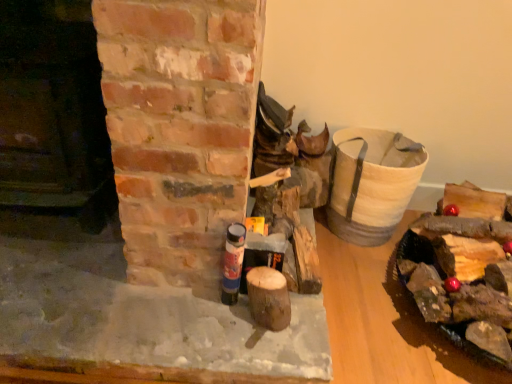
This screenshot has height=384, width=512. What do you see at coordinates (465, 267) in the screenshot?
I see `wooden logs at right` at bounding box center [465, 267].

You are a GUI agent. You are given a task and a screenshot of the screen. Output one action in this format:
    pyautogui.click(x=<x>, y=<y>)
    Task: Click on the blue matte spray can at center
    The image size is (512, 384).
    Given the screenshot: What is the action you would take?
    (232, 263)

How much space does smooth brick fireplace at center, the second fireplace in the top-to-bottom sequence, occupy horizontally?

3.66 feet.

Locate an element on the screen. The height and width of the screenshot is (384, 512). smooth dark brown wood at left, which ranks as the 1th fireplace in top-to-bottom order is located at coordinates (53, 125).

Do you think smooth dark brown wood at left, which ranks as the 1th fireplace in top-to-bottom order, is within wooden logs at right, or outside of it?

smooth dark brown wood at left, which ranks as the 1th fireplace in top-to-bottom order, is not enclosed by wooden logs at right.

Between smooth dark brown wood at left, which ranks as the 1th fireplace in top-to-bottom order, and wooden logs at right, which one has smaller size?

wooden logs at right.

Considering the relative positions of smooth dark brown wood at left, which ranks as the 1th fireplace in top-to-bottom order, and wooden logs at right in the image provided, is smooth dark brown wood at left, which ranks as the 1th fireplace in top-to-bottom order, to the left or to the right of wooden logs at right?

From the image, it's evident that smooth dark brown wood at left, which ranks as the 1th fireplace in top-to-bottom order, is to the left of wooden logs at right.

Does blue matte spray can at center come behind wooden logs at right?

Yes, the depth of blue matte spray can at center is greater than that of wooden logs at right.

Is point (223, 295) behind point (468, 332)?

Yes.

Does blue matte spray can at center appear on the right side of wooden logs at right?

No.

From a real-world perspective, is blue matte spray can at center physically located above or below wooden logs at right?

In terms of real-world spatial position, blue matte spray can at center is above wooden logs at right.

Which of these two, wooden logs at right or smooth dark brown wood at left, placed as the 2th fireplace when sorted from bottom to top, stands shorter?

wooden logs at right is shorter.

From the image's perspective, is wooden logs at right above or below smooth dark brown wood at left, placed as the 2th fireplace when sorted from bottom to top?

wooden logs at right is situated lower than smooth dark brown wood at left, placed as the 2th fireplace when sorted from bottom to top, in the image.

Considering the sizes of wooden logs at right and smooth dark brown wood at left, placed as the 2th fireplace when sorted from bottom to top, in the image, is wooden logs at right bigger or smaller than smooth dark brown wood at left, placed as the 2th fireplace when sorted from bottom to top,?

Considering their sizes, wooden logs at right takes up less space than smooth dark brown wood at left, placed as the 2th fireplace when sorted from bottom to top.

From a real-world perspective, which object stands above the other?

smooth dark brown wood at left, which ranks as the 1th fireplace in top-to-bottom order, from a real-world perspective.

Considering the positions of objects blue matte spray can at center and smooth dark brown wood at left, which ranks as the 1th fireplace in top-to-bottom order, in the image provided, who is in front, blue matte spray can at center or smooth dark brown wood at left, which ranks as the 1th fireplace in top-to-bottom order,?

smooth dark brown wood at left, which ranks as the 1th fireplace in top-to-bottom order, is more forward.

Is blue matte spray can at center not near smooth dark brown wood at left, placed as the 2th fireplace when sorted from bottom to top?

Actually, blue matte spray can at center and smooth dark brown wood at left, placed as the 2th fireplace when sorted from bottom to top, are a little close together.

Looking at this image, which object is wider, blue matte spray can at center or smooth dark brown wood at left, placed as the 2th fireplace when sorted from bottom to top?

With larger width is smooth dark brown wood at left, placed as the 2th fireplace when sorted from bottom to top.

Between blue matte spray can at center and smooth brick fireplace at center, which appears as the first fireplace when ordered from the bottom, which one has less height?

With less height is smooth brick fireplace at center, which appears as the first fireplace when ordered from the bottom.

Consider the image. From a real-world perspective, is blue matte spray can at center positioned above or below smooth brick fireplace at center, which appears as the first fireplace when ordered from the bottom?

blue matte spray can at center is situated higher than smooth brick fireplace at center, which appears as the first fireplace when ordered from the bottom, in the real world.

Based on the photo, can you confirm if blue matte spray can at center is thinner than smooth brick fireplace at center, which appears as the first fireplace when ordered from the bottom?

Correct, the width of blue matte spray can at center is less than that of smooth brick fireplace at center, which appears as the first fireplace when ordered from the bottom.

In the scene shown: Can you tell me how much blue matte spray can at center and smooth brick fireplace at center, the second fireplace in the top-to-bottom sequence, differ in facing direction?

1.97 degrees separate the facing orientations of blue matte spray can at center and smooth brick fireplace at center, the second fireplace in the top-to-bottom sequence.

Is smooth dark brown wood at left, placed as the 2th fireplace when sorted from bottom to top, outside of smooth brick fireplace at center, the second fireplace in the top-to-bottom sequence?

Absolutely, smooth dark brown wood at left, placed as the 2th fireplace when sorted from bottom to top, is external to smooth brick fireplace at center, the second fireplace in the top-to-bottom sequence.

Is smooth dark brown wood at left, which ranks as the 1th fireplace in top-to-bottom order, thinner than smooth brick fireplace at center, the second fireplace in the top-to-bottom sequence?

Yes, smooth dark brown wood at left, which ranks as the 1th fireplace in top-to-bottom order, is thinner than smooth brick fireplace at center, the second fireplace in the top-to-bottom sequence.

Considering the sizes of objects smooth dark brown wood at left, placed as the 2th fireplace when sorted from bottom to top, and smooth brick fireplace at center, the second fireplace in the top-to-bottom sequence, in the image provided, who is taller, smooth dark brown wood at left, placed as the 2th fireplace when sorted from bottom to top, or smooth brick fireplace at center, the second fireplace in the top-to-bottom sequence,?

smooth dark brown wood at left, placed as the 2th fireplace when sorted from bottom to top, is taller.

Is smooth dark brown wood at left, placed as the 2th fireplace when sorted from bottom to top, far from smooth brick fireplace at center, which appears as the first fireplace when ordered from the bottom?

No.

Consider the image. Is smooth brick fireplace at center, which appears as the first fireplace when ordered from the bottom, wider or thinner than blue matte spray can at center?

smooth brick fireplace at center, which appears as the first fireplace when ordered from the bottom, is wider than blue matte spray can at center.

Which object is further away from the camera, smooth brick fireplace at center, which appears as the first fireplace when ordered from the bottom, or blue matte spray can at center?

blue matte spray can at center is more distant.

Measure the distance from smooth brick fireplace at center, which appears as the first fireplace when ordered from the bottom, to blue matte spray can at center.

The distance of smooth brick fireplace at center, which appears as the first fireplace when ordered from the bottom, from blue matte spray can at center is 28.90 centimeters.

From the image's perspective, would you say smooth brick fireplace at center, which appears as the first fireplace when ordered from the bottom, is positioned over blue matte spray can at center?

Correct, smooth brick fireplace at center, which appears as the first fireplace when ordered from the bottom, appears higher than blue matte spray can at center in the image.

The height and width of the screenshot is (384, 512). What are the coordinates of `fireplace above the wooden logs at right (from a real-world perspective)` in the screenshot? It's located at (53, 125).

Image resolution: width=512 pixels, height=384 pixels. I want to click on debris below the blue matte spray can at center (from a real-world perspective), so click(465, 267).

Considering their positions, is blue matte spray can at center positioned closer to wooden logs at right than smooth dark brown wood at left, which ranks as the 1th fireplace in top-to-bottom order?

Based on the image, blue matte spray can at center appears to be nearer to wooden logs at right.

Which object lies nearer to the anchor point smooth dark brown wood at left, which ranks as the 1th fireplace in top-to-bottom order, smooth brick fireplace at center, the second fireplace in the top-to-bottom sequence, or blue matte spray can at center?

smooth brick fireplace at center, the second fireplace in the top-to-bottom sequence.

Estimate the real-world distances between objects in this image. Which object is further from smooth dark brown wood at left, which ranks as the 1th fireplace in top-to-bottom order, blue matte spray can at center or smooth brick fireplace at center, the second fireplace in the top-to-bottom sequence?

blue matte spray can at center is further to smooth dark brown wood at left, which ranks as the 1th fireplace in top-to-bottom order.

Looking at this image, which object lies nearer to the anchor point smooth brick fireplace at center, the second fireplace in the top-to-bottom sequence, smooth dark brown wood at left, placed as the 2th fireplace when sorted from bottom to top, or blue matte spray can at center?

Based on the image, blue matte spray can at center appears to be nearer to smooth brick fireplace at center, the second fireplace in the top-to-bottom sequence.

Estimate the real-world distances between objects in this image. Which object is closer to blue matte spray can at center, smooth dark brown wood at left, placed as the 2th fireplace when sorted from bottom to top, or smooth brick fireplace at center, which appears as the first fireplace when ordered from the bottom?

smooth brick fireplace at center, which appears as the first fireplace when ordered from the bottom, lies closer to blue matte spray can at center than the other object.

When comparing their distances from smooth brick fireplace at center, the second fireplace in the top-to-bottom sequence, does wooden logs at right or smooth dark brown wood at left, placed as the 2th fireplace when sorted from bottom to top, seem further?

wooden logs at right.

When comparing their distances from wooden logs at right, does smooth dark brown wood at left, placed as the 2th fireplace when sorted from bottom to top, or smooth brick fireplace at center, which appears as the first fireplace when ordered from the bottom, seem closer?

smooth brick fireplace at center, which appears as the first fireplace when ordered from the bottom, is positioned closer to the anchor wooden logs at right.

Considering their positions, is blue matte spray can at center positioned closer to wooden logs at right than smooth brick fireplace at center, the second fireplace in the top-to-bottom sequence?

The object closer to wooden logs at right is smooth brick fireplace at center, the second fireplace in the top-to-bottom sequence.

Locate an element on the screen. fireplace located between smooth dark brown wood at left, which ranks as the 1th fireplace in top-to-bottom order, and wooden logs at right in the left-right direction is located at coordinates (163, 217).

Locate an element on the screen. bottle located between smooth dark brown wood at left, which ranks as the 1th fireplace in top-to-bottom order, and wooden logs at right in the left-right direction is located at coordinates (232, 263).

Find the location of `bottle between smooth brick fireplace at center, which appears as the first fireplace when ordered from the bottom, and wooden logs at right`. bottle between smooth brick fireplace at center, which appears as the first fireplace when ordered from the bottom, and wooden logs at right is located at coordinates (232, 263).

The width and height of the screenshot is (512, 384). Find the location of `fireplace between smooth dark brown wood at left, which ranks as the 1th fireplace in top-to-bottom order, and blue matte spray can at center`. fireplace between smooth dark brown wood at left, which ranks as the 1th fireplace in top-to-bottom order, and blue matte spray can at center is located at coordinates (163, 217).